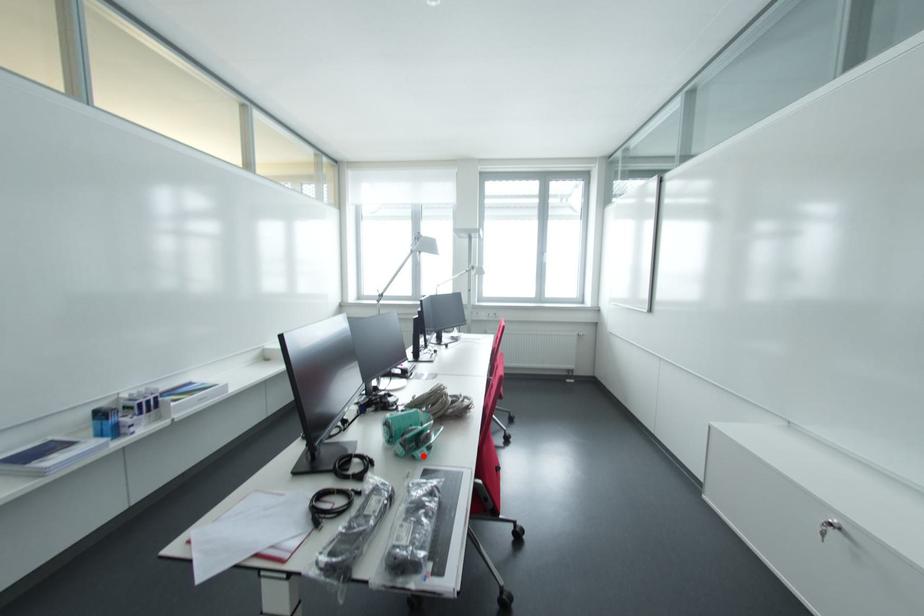
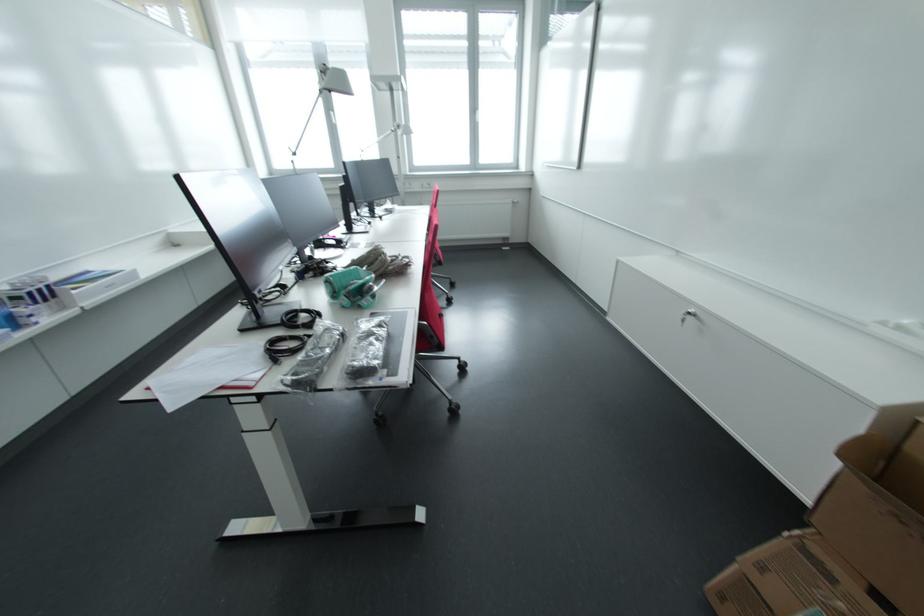
Find the pixel in the second image that matches the highlighted location in the first image.

(369, 304)